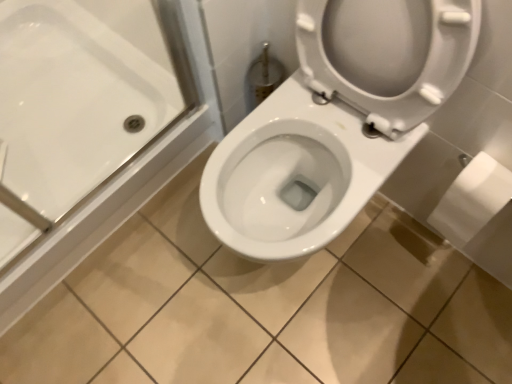
Find the location of a particular element. This screenshot has height=384, width=512. white matte toilet paper at right is located at coordinates (472, 199).

This screenshot has height=384, width=512. Find the location of `white glossy toilet at center`. white glossy toilet at center is located at coordinates (336, 121).

Describe the element at coordinates (80, 103) in the screenshot. I see `white glossy bathtub at upper left` at that location.

I want to click on white matte toilet paper at right, so click(472, 199).

The width and height of the screenshot is (512, 384). Identify the location of bath that appears above the white matte toilet paper at right (from a real-world perspective). (80, 103).

Measure the distance between white glossy bathtub at upper left and white matte toilet paper at right.

white glossy bathtub at upper left is 1.04 meters from white matte toilet paper at right.

Considering the relative positions of white glossy bathtub at upper left and white matte toilet paper at right in the image provided, is white glossy bathtub at upper left in front of white matte toilet paper at right?

Yes, it is.

From the image's perspective, which one is positioned lower, white glossy bathtub at upper left or white matte toilet paper at right?

From the image's view, white matte toilet paper at right is below.

Considering the relative positions of white glossy toilet at center and white matte toilet paper at right in the image provided, is white glossy toilet at center in front of white matte toilet paper at right?

Yes.

Looking at this image, is white glossy toilet at center thinner than white matte toilet paper at right?

Incorrect, the width of white glossy toilet at center is not less than that of white matte toilet paper at right.

From a real-world perspective, who is located lower, white glossy toilet at center or white matte toilet paper at right?

In real-world perspective, white matte toilet paper at right is lower.

Is white glossy toilet at center to the left of white matte toilet paper at right from the viewer's perspective?

Indeed, white glossy toilet at center is positioned on the left side of white matte toilet paper at right.

Considering the sizes of objects white glossy bathtub at upper left and white glossy toilet at center in the image provided, who is smaller, white glossy bathtub at upper left or white glossy toilet at center?

white glossy bathtub at upper left.

From the image's perspective, is white glossy bathtub at upper left located above or below white glossy toilet at center?

white glossy bathtub at upper left is situated higher than white glossy toilet at center in the image.

Is white glossy bathtub at upper left taller or shorter than white glossy toilet at center?

white glossy bathtub at upper left is shorter than white glossy toilet at center.

Is white matte toilet paper at right facing towards white glossy bathtub at upper left?

No, white matte toilet paper at right is not aimed at white glossy bathtub at upper left.

Does white matte toilet paper at right come behind white glossy bathtub at upper left?

Yes, it is behind white glossy bathtub at upper left.

From the image's perspective, is white matte toilet paper at right located above or below white glossy bathtub at upper left?

white matte toilet paper at right is situated lower than white glossy bathtub at upper left in the image.

Which of these two, white matte toilet paper at right or white glossy bathtub at upper left, is bigger?

With larger size is white glossy bathtub at upper left.

Is white glossy toilet at center turned away from white glossy bathtub at upper left?

That's not correct — white glossy toilet at center is not looking away from white glossy bathtub at upper left.

Considering the points (241, 145) and (67, 41), which point is in front, point (241, 145) or point (67, 41)?

The point (241, 145) is in front.

At what (x,y) coordinates should I click in order to perform the action: click on bath behind the white glossy toilet at center. Please return your answer as a coordinate pair (x, y). Looking at the image, I should click on (80, 103).

Is white glossy toilet at center with white glossy bathtub at upper left?

white glossy toilet at center and white glossy bathtub at upper left are clearly separated.

From the image's perspective, is white matte toilet paper at right on white glossy toilet at center?

No, from the image's perspective, white matte toilet paper at right is not on top of white glossy toilet at center.

Between white matte toilet paper at right and white glossy toilet at center, which one has more height?

white glossy toilet at center.

Considering the relative sizes of white matte toilet paper at right and white glossy toilet at center in the image provided, is white matte toilet paper at right smaller than white glossy toilet at center?

Yes.

Which object is positioned more to the left, white matte toilet paper at right or white glossy toilet at center?

white glossy toilet at center.

Find the location of `toilet paper that appears on the right of white glossy bathtub at upper left`. toilet paper that appears on the right of white glossy bathtub at upper left is located at coordinates (472, 199).

Identify the location of toilet paper located below the white glossy toilet at center (from the image's perspective). This screenshot has height=384, width=512. (472, 199).

Looking at the image, which one is located further to white glossy toilet at center, white matte toilet paper at right or white glossy bathtub at upper left?

The object further to white glossy toilet at center is white glossy bathtub at upper left.

Looking at the image, which one is located further to white matte toilet paper at right, white glossy bathtub at upper left or white glossy toilet at center?

Based on the image, white glossy bathtub at upper left appears to be further to white matte toilet paper at right.

When comparing their distances from white glossy bathtub at upper left, does white glossy toilet at center or white matte toilet paper at right seem further?

white matte toilet paper at right is further to white glossy bathtub at upper left.

Considering their positions, is white glossy toilet at center positioned further to white matte toilet paper at right than white glossy bathtub at upper left?

white glossy bathtub at upper left.

Based on their spatial positions, is white glossy bathtub at upper left or white matte toilet paper at right further from white glossy toilet at center?

Based on the image, white glossy bathtub at upper left appears to be further to white glossy toilet at center.

When comparing their distances from white glossy bathtub at upper left, does white matte toilet paper at right or white glossy toilet at center seem further?

The object further to white glossy bathtub at upper left is white matte toilet paper at right.

This screenshot has height=384, width=512. Identify the location of toilet between white glossy bathtub at upper left and white matte toilet paper at right from left to right. (336, 121).